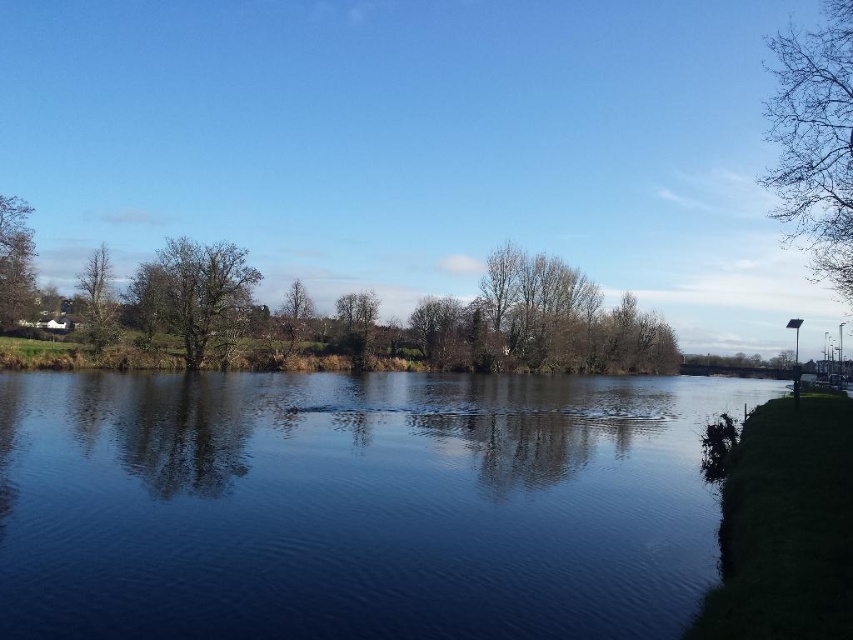
Find the location of `blue reflective water at center`. blue reflective water at center is located at coordinates (357, 504).

Is blue reflective water at center to the left of bare branches at center from the viewer's perspective?

Yes, blue reflective water at center is to the left of bare branches at center.

Locate an element on the screen. The image size is (853, 640). blue reflective water at center is located at coordinates (357, 504).

Between green leafy tree at left and green matte tree at left, which one appears on the left side from the viewer's perspective?

Positioned to the left is green leafy tree at left.

The height and width of the screenshot is (640, 853). Describe the element at coordinates (15, 260) in the screenshot. I see `green leafy tree at left` at that location.

You are a GUI agent. You are given a task and a screenshot of the screen. Output one action in this format:
    pyautogui.click(x=<x>, y=<y>)
    Task: Click on the green leafy tree at left
    
    Given the screenshot: What is the action you would take?
    pyautogui.click(x=15, y=260)

Does brown textured tree at left have a smaller size compared to green matte tree at left?

No, brown textured tree at left is not smaller than green matte tree at left.

Image resolution: width=853 pixels, height=640 pixels. Describe the element at coordinates (195, 294) in the screenshot. I see `brown textured tree at left` at that location.

Is point (146, 288) closer to viewer compared to point (105, 257)?

Yes, it is in front of point (105, 257).

Identify the location of brown textured tree at left. (195, 294).